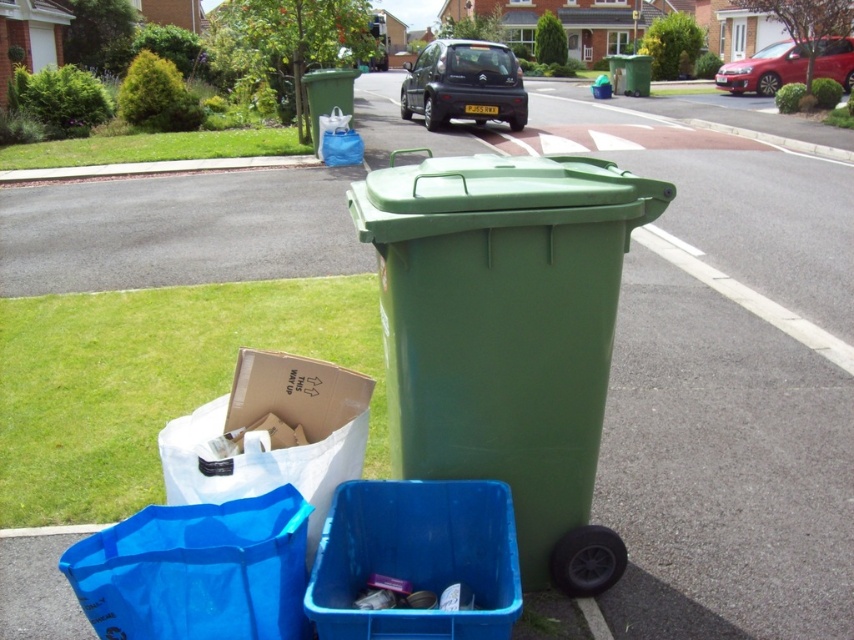
Does matte black car at center have a lesser width compared to green plastic bin at upper center?

In fact, matte black car at center might be wider than green plastic bin at upper center.

Between matte black car at center and green plastic bin at upper center, which one has less height?

Standing shorter between the two is green plastic bin at upper center.

The image size is (854, 640). Identify the location of matte black car at center. (464, 84).

Can you confirm if green plastic recycling bin at center is positioned below green plastic bin at upper center?

Correct, green plastic recycling bin at center is located below green plastic bin at upper center.

Which is behind, point (607, 232) or point (319, 138)?

Point (319, 138)

Which is in front, point (589, 371) or point (332, 97)?

Positioned in front is point (589, 371).

Identify the location of green plastic recycling bin at center. pyautogui.click(x=506, y=333).

Does point (167, 531) come farther from viewer compared to point (828, 76)?

No, it is in front of (828, 76).

Does blue plastic bag at lower left appear on the right side of metallic red sedan at upper right?

Incorrect, blue plastic bag at lower left is not on the right side of metallic red sedan at upper right.

Is point (264, 504) closer to viewer compared to point (834, 67)?

Yes, it is.

This screenshot has height=640, width=854. Find the location of `blue plastic bag at lower left`. blue plastic bag at lower left is located at coordinates (197, 572).